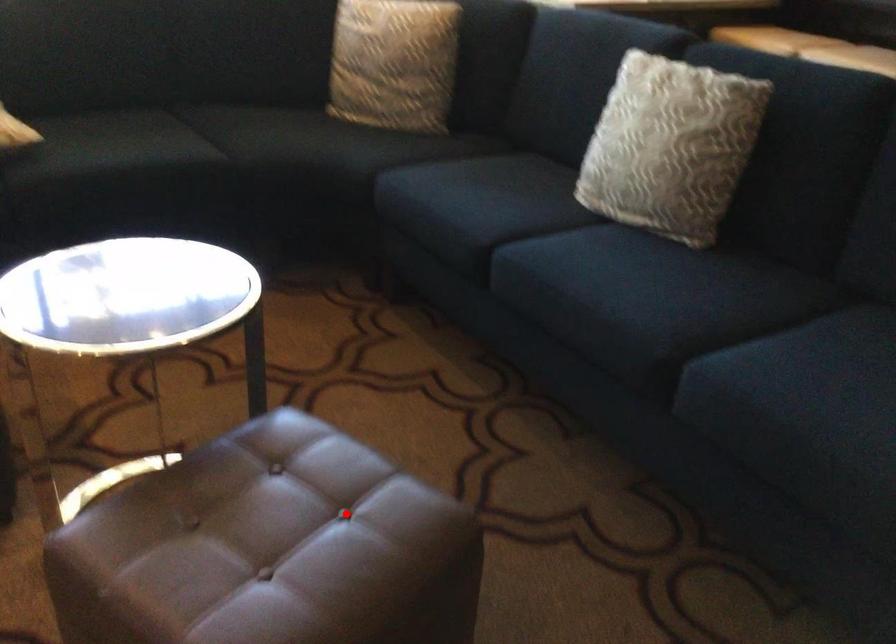
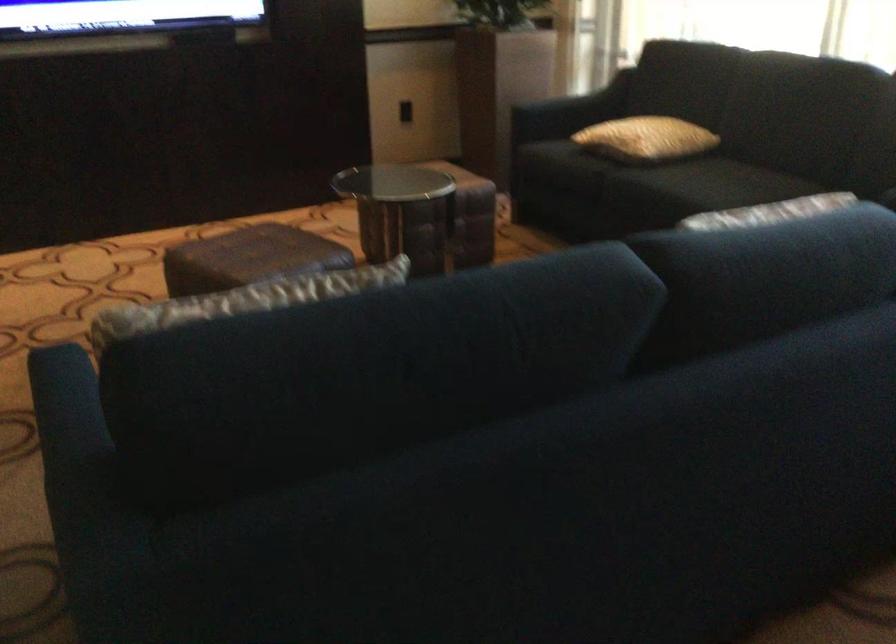
Question: I am providing you with two images of the same scene from different viewpoints. A red point is shown in image1. For the corresponding object point in image2, is it positioned nearer or farther from the camera?

Choices:
 (A) Nearer
 (B) Farther

Answer: (B)